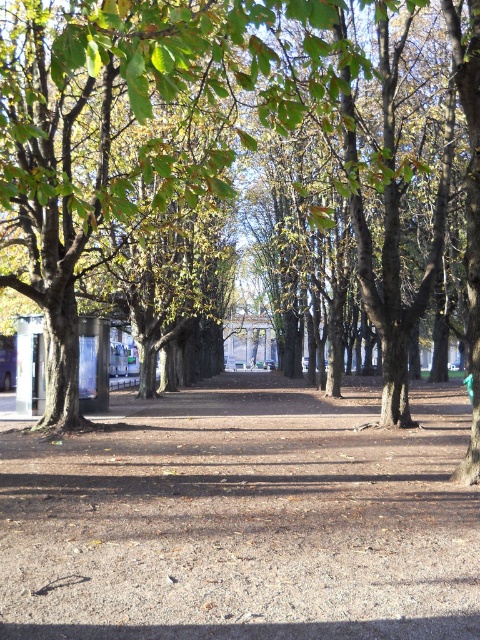
Is brown gravel path at center to the left of green leafy tree at center from the viewer's perspective?

In fact, brown gravel path at center is to the right of green leafy tree at center.

Is brown gravel path at center wider than green leafy tree at center?

Yes.

Between point (336, 609) and point (197, 22), which one is positioned in front?

Point (336, 609)

The image size is (480, 640). What are the coordinates of `brown gravel path at center` in the screenshot? It's located at (242, 518).